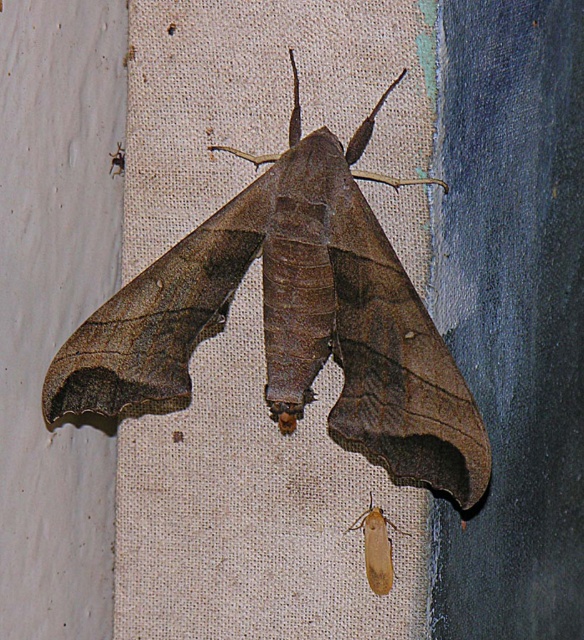
You are an entomologist observing the image. You need to locate the brown matte moth at center. What are its coordinates?

The brown matte moth at center is located at coordinates point [292,321].

You are an entomologist examining the image. You need to determine which of the two moths, the brown matte moth at center or the light brown fuzzy moth at lower right, has a greater wingspan. Based on the information provided, which one has a larger wingspan?

The brown matte moth at center has a larger wingspan than the light brown fuzzy moth at lower right because its width is greater as stated in the description.